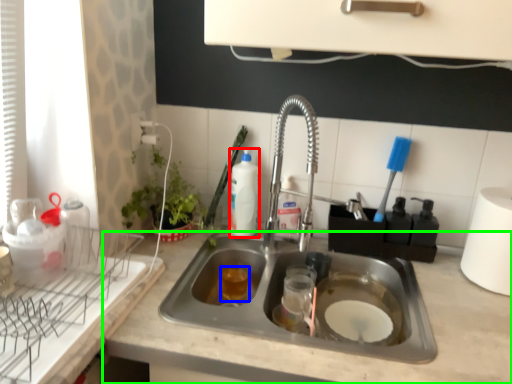
Question: Which is farther away from beverage (highlighted by a red box)? beverage (highlighted by a blue box) or countertop (highlighted by a green box)?

Choices:
 (A) beverage
 (B) countertop

Answer: (B)